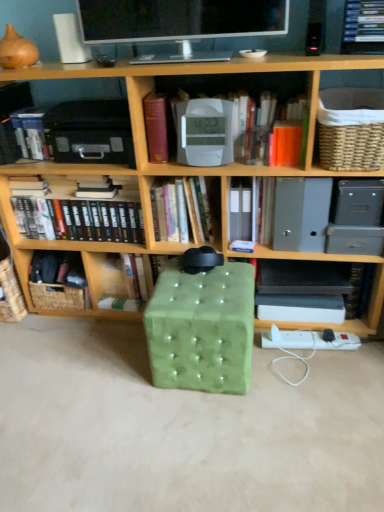
Locate an element on the screen. This screenshot has height=512, width=384. free space in front of wooden bookshelf at center is located at coordinates pos(204,426).